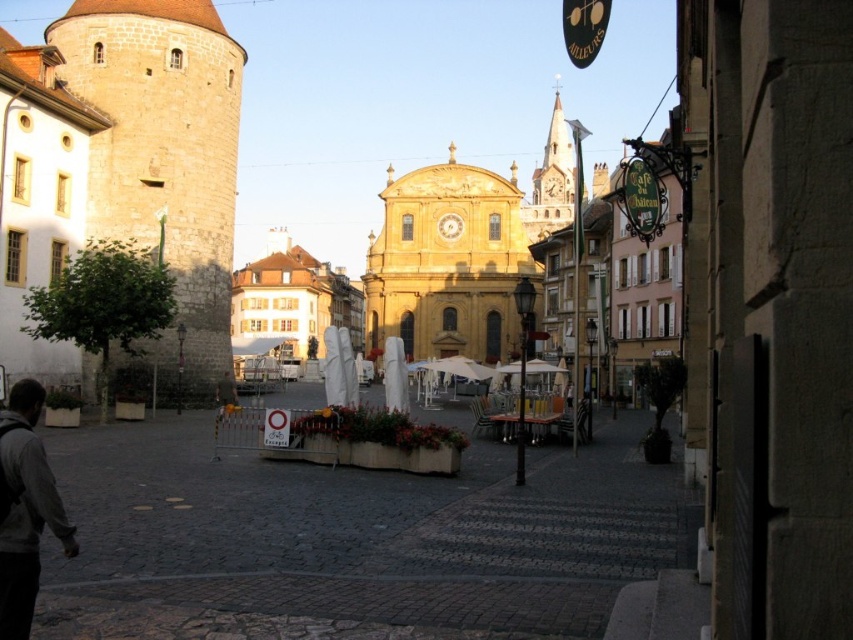
Question: Which point is closer to the camera?

Choices:
 (A) dark gray jacket at lower left
 (B) smooth stone alley at center
 (C) brown stone tower at left
 (D) gray hoodie at lower left

Answer: (D)

Question: Does smooth stone alley at center have a lesser width compared to golden stone church at center?

Choices:
 (A) no
 (B) yes

Answer: (A)

Question: Which of the following is the farthest from the observer?

Choices:
 (A) (13, 579)
 (B) (323, 513)
 (C) (180, 1)
 (D) (436, 248)

Answer: (D)

Question: Among these objects, which one is nearest to the camera?

Choices:
 (A) dark gray jacket at lower left
 (B) brown stone tower at left
 (C) gray hoodie at lower left

Answer: (C)

Question: Is brown stone tower at left further to camera compared to dark gray jacket at lower left?

Choices:
 (A) yes
 (B) no

Answer: (A)

Question: Does brown stone tower at left have a lesser width compared to golden stone church at center?

Choices:
 (A) yes
 (B) no

Answer: (A)